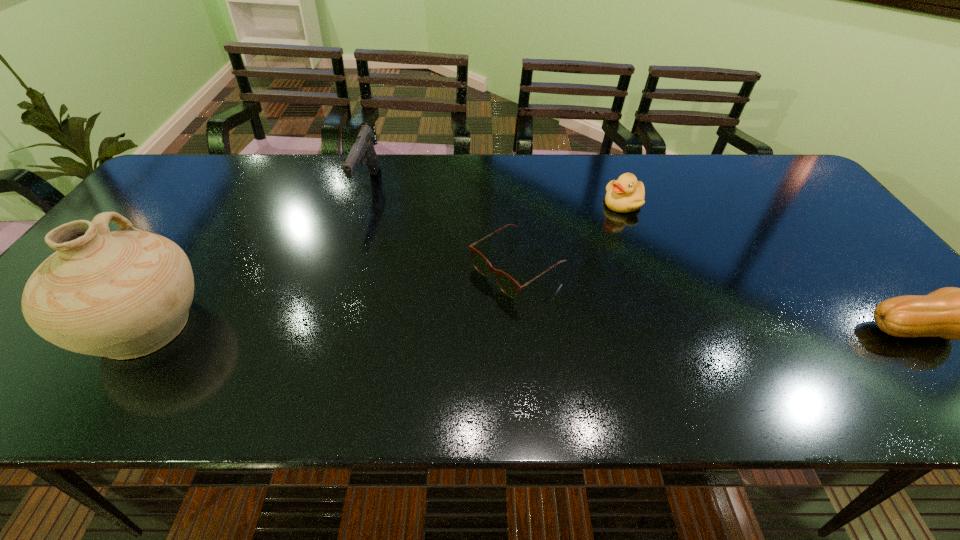
In order to click on vacant spot on the desktop that is between the tallest object and the gourd and is positioned on the front-facing side of the duckling in this screenshot , I will do `click(552, 328)`.

At what (x,y) coordinates should I click in order to perform the action: click on vacant spot on the desktop that is between the leftmost object and the rightmost object and is positioned at the front view of the third object from right to left. Please return your answer as a coordinate pair (x, y). Looking at the image, I should click on (425, 327).

Find the location of `free space on the desktop that is between the pottery and the gourd and is positioned at the muzzle of the second object from left to right`. free space on the desktop that is between the pottery and the gourd and is positioned at the muzzle of the second object from left to right is located at coordinates (481, 327).